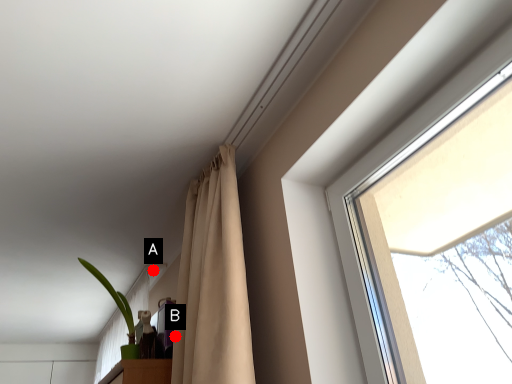
Question: Two points are circled on the image, labeled by A and B beside each circle. Which of the following is the closest to the observer?

Choices:
 (A) A is closer
 (B) B is closer

Answer: (B)